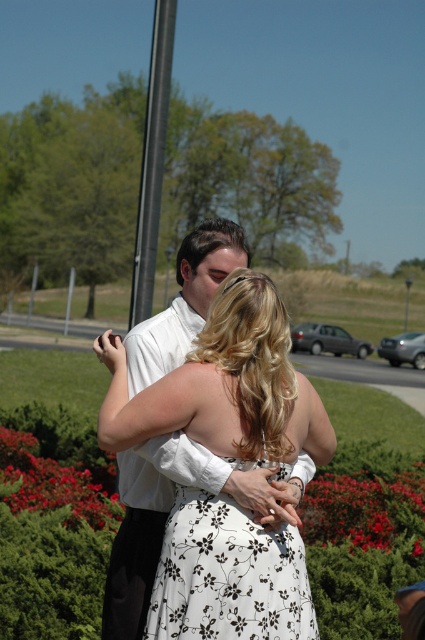
Question: Which of the following is the closest to the observer?

Choices:
 (A) white floral dress at center
 (B) white floral fabric dress at center
 (C) silver metallic sedan at center
 (D) black smooth pole at upper center

Answer: (B)

Question: Which object is positioned farthest from the black smooth pole at upper center?

Choices:
 (A) silver metallic sedan at center
 (B) white floral fabric dress at center

Answer: (A)

Question: Observing the image, what is the correct spatial positioning of silver metallic sedan at center in reference to silver metallic sedan at lower right?

Choices:
 (A) left
 (B) right

Answer: (A)

Question: Which point is farther to the camera?

Choices:
 (A) (388, 346)
 (B) (258, 384)
 (C) (323, 340)

Answer: (A)

Question: Does white floral fabric dress at center appear on the left side of silver metallic sedan at center?

Choices:
 (A) yes
 (B) no

Answer: (A)

Question: Can you confirm if white floral dress at center is wider than white floral fabric dress at center?

Choices:
 (A) yes
 (B) no

Answer: (A)